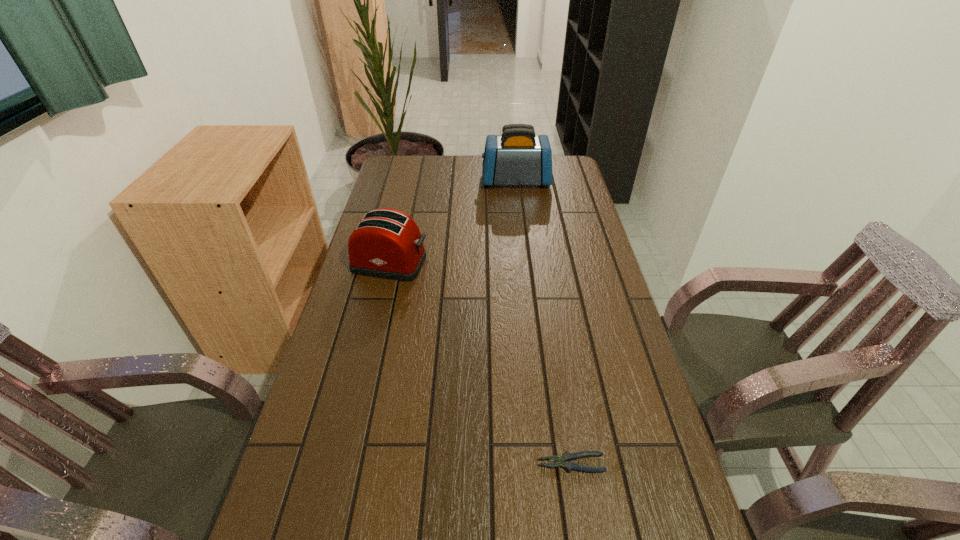
Image resolution: width=960 pixels, height=540 pixels. What are the coordinates of `free area in between the pliers and the right toaster` in the screenshot? It's located at (543, 322).

Where is `blank region between the left toaster and the farther toaster`? This screenshot has width=960, height=540. blank region between the left toaster and the farther toaster is located at coordinates (453, 222).

Locate an element on the screen. object that stands as the closest to the shortest object is located at coordinates (387, 243).

In order to click on object that is the second closest to the shortest object in this screenshot , I will do `click(517, 157)`.

Where is `vacant space that satisfies the following two spatial constraints: 1. on the front-facing side of the farther toaster; 2. on the front side of the nearer toaster`? Image resolution: width=960 pixels, height=540 pixels. vacant space that satisfies the following two spatial constraints: 1. on the front-facing side of the farther toaster; 2. on the front side of the nearer toaster is located at coordinates (525, 264).

This screenshot has height=540, width=960. I want to click on vacant region that satisfies the following two spatial constraints: 1. on the front-facing side of the farther toaster; 2. on the front side of the second shortest object, so click(525, 264).